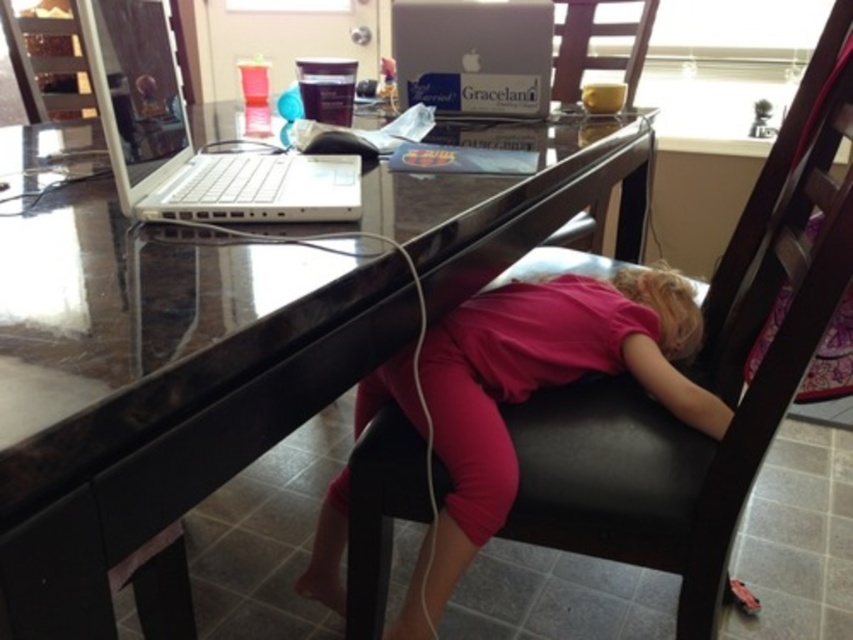
Question: Estimate the real-world distances between objects in this image. Which object is closer to the white plastic laptop at upper left?

Choices:
 (A) glossy wood table at center
 (B) pink matte shirt at center

Answer: (A)

Question: Among these objects, which one is nearest to the camera?

Choices:
 (A) pink matte shirt at center
 (B) glossy wood table at center
 (C) wooden chair at upper center

Answer: (B)

Question: Observing the image, what is the correct spatial positioning of black leather chair at center in reference to pink matte shirt at center?

Choices:
 (A) left
 (B) right

Answer: (B)

Question: Is black leather chair at center above satin silver laptop at upper center?

Choices:
 (A) no
 (B) yes

Answer: (A)

Question: Which object is positioned closest to the black leather chair at center?

Choices:
 (A) glossy wood table at center
 (B) white plastic laptop at upper left
 (C) wooden chair at upper center
 (D) satin silver laptop at upper center

Answer: (A)

Question: Is black leather chair at center above white plastic laptop at upper left?

Choices:
 (A) no
 (B) yes

Answer: (A)